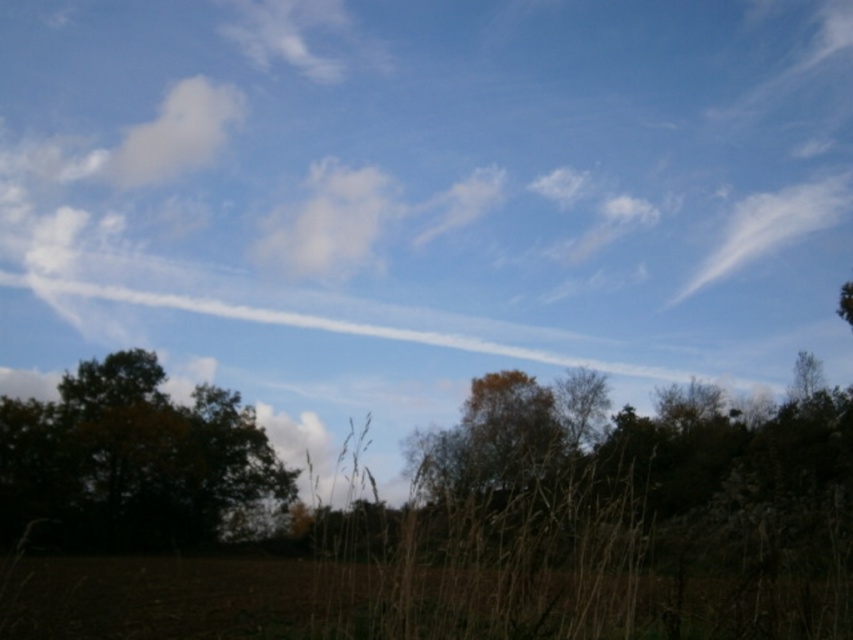
Does brown leafy tree at lower left have a greater height compared to white fluffy cloud at upper left?

No, brown leafy tree at lower left is not taller than white fluffy cloud at upper left.

You are a GUI agent. You are given a task and a screenshot of the screen. Output one action in this format:
    pyautogui.click(x=<x>, y=<y>)
    Task: Click on the brown leafy tree at lower left
    Image resolution: width=853 pixels, height=640 pixels.
    Given the screenshot: What is the action you would take?
    pyautogui.click(x=131, y=460)

Measure the distance between brown leafy tree at lower left and camera.

brown leafy tree at lower left is 184.68 feet from camera.

Locate an element on the screen. This screenshot has width=853, height=640. brown leafy tree at lower left is located at coordinates (131, 460).

Does point (126, 486) come in front of point (837, 205)?

Yes, point (126, 486) is closer to viewer.

Can you confirm if brown leafy tree at lower left is positioned to the left of white cotton cloud at upper right?

Indeed, brown leafy tree at lower left is positioned on the left side of white cotton cloud at upper right.

At what (x,y) coordinates should I click in order to perform the action: click on brown leafy tree at lower left. Please return your answer as a coordinate pair (x, y). The image size is (853, 640). Looking at the image, I should click on (131, 460).

Between point (329, 184) and point (840, 216), which one is positioned behind?

The point (840, 216) is more distant.

Does white fluffy cloud at center have a lesser width compared to white cotton cloud at upper right?

Indeed, white fluffy cloud at center has a lesser width compared to white cotton cloud at upper right.

This screenshot has width=853, height=640. What are the coordinates of `white fluffy cloud at center` in the screenshot? It's located at (328, 221).